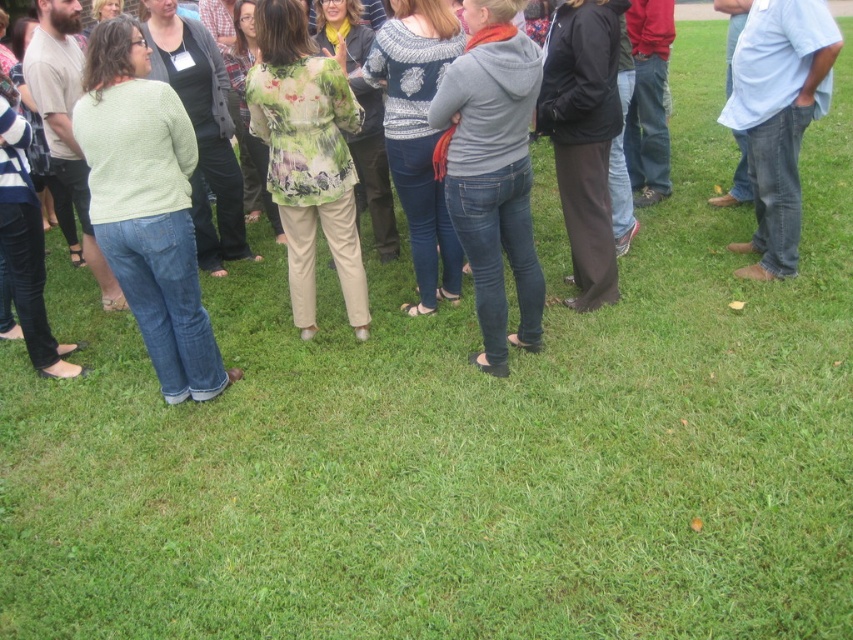
You are standing at the origin point of the coordinate system. You want to move towards the light green knitted sweater at center. What direction should you move in?

Since the light green knitted sweater at center is located at coordinate point 0.323 in the x direction and 0.174 in the y direction, you should move towards the northeast direction to reach it.